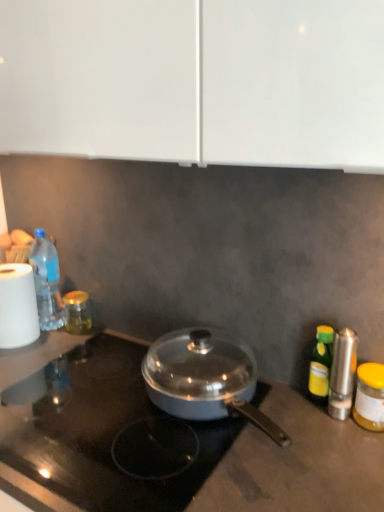
Identify the location of free space in front of silver metallic salt shaker at right. The image size is (384, 512). (338, 462).